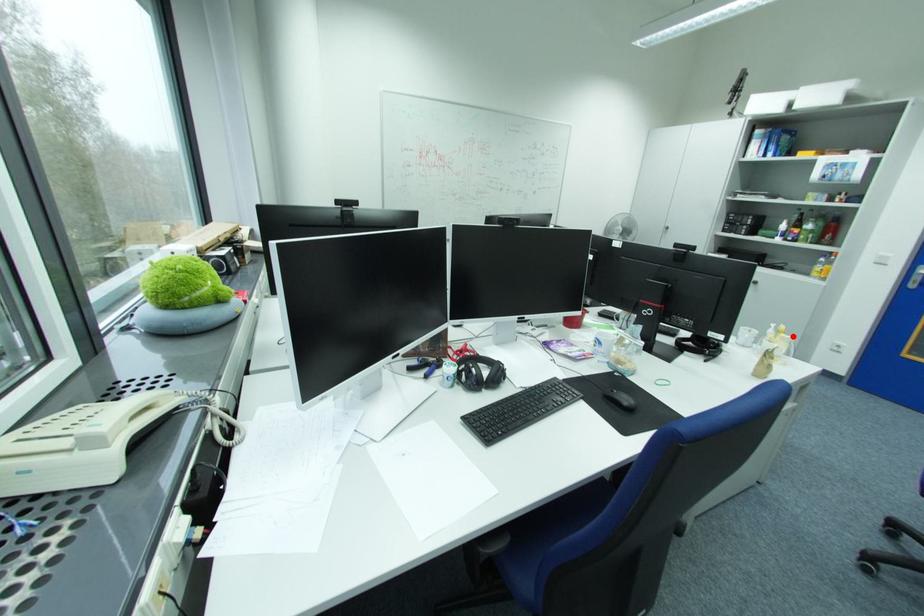
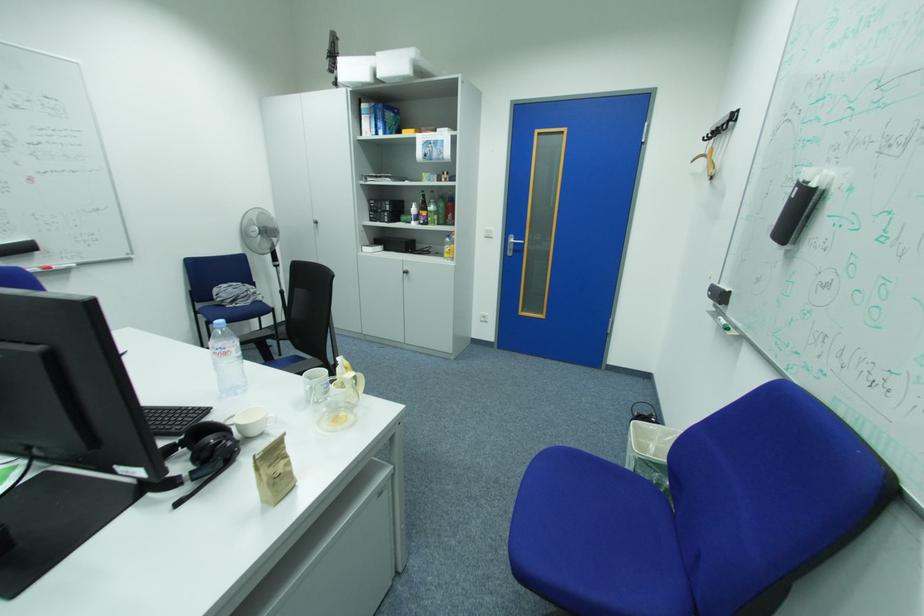
Question: I am providing you with two images of the same scene from different viewpoints. In image1, a red point is highlighted. Considering the same 3D point in image2, which of the following is correct?

Choices:
 (A) It is closer
 (B) It is farther

Answer: (A)